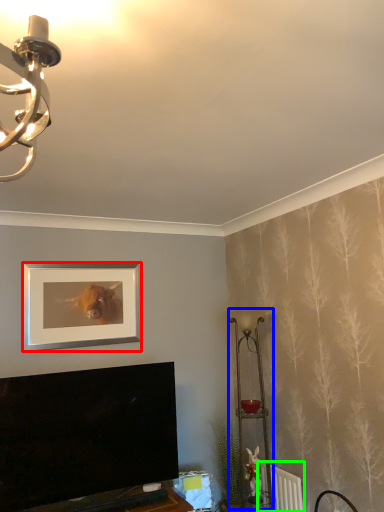
Question: Which is farther away from picture frame (highlighted by a red box)? table lamp (highlighted by a blue box) or radiator (highlighted by a green box)?

Choices:
 (A) table lamp
 (B) radiator

Answer: (B)